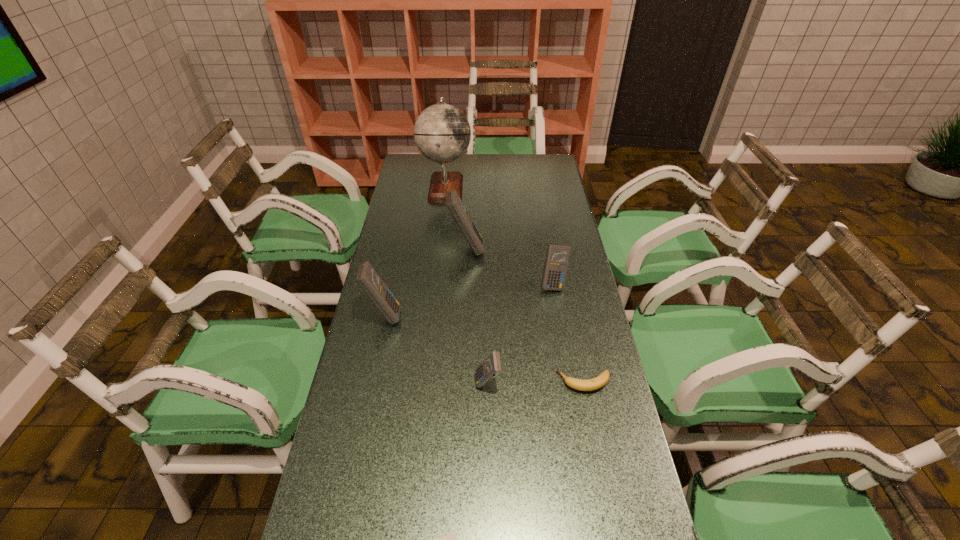
Where is `the tallest object`? Image resolution: width=960 pixels, height=540 pixels. the tallest object is located at coordinates (442, 133).

This screenshot has width=960, height=540. I want to click on the farthest object, so click(442, 133).

I want to click on the farthest calculator, so click(x=453, y=202).

You are a GUI agent. You are given a task and a screenshot of the screen. Output one action in this format:
    pyautogui.click(x=<x>, y=<y>)
    Task: Click on the farthest blue calculator
    
    Given the screenshot: What is the action you would take?
    pyautogui.click(x=453, y=202)

You are a GUI agent. You are given a task and a screenshot of the screen. Output one action in this format:
    pyautogui.click(x=<x>, y=<y>)
    Task: Click on the leftmost blue calculator
    The image size is (960, 540).
    Given the screenshot: What is the action you would take?
    pyautogui.click(x=367, y=278)

Find the location of a particular element. The height and width of the screenshot is (540, 960). the leftmost calculator is located at coordinates pos(367,278).

The width and height of the screenshot is (960, 540). I want to click on the second smallest blue calculator, so click(557, 257).

At what (x,y) coordinates should I click in order to perform the action: click on the third shortest calculator. Please return your answer as a coordinate pair (x, y). This screenshot has height=540, width=960. Looking at the image, I should click on (557, 257).

Image resolution: width=960 pixels, height=540 pixels. I want to click on the fourth tallest calculator, so click(491, 366).

Find the location of a particular element. Image resolution: width=960 pixels, height=540 pixels. the third shortest object is located at coordinates pos(491,366).